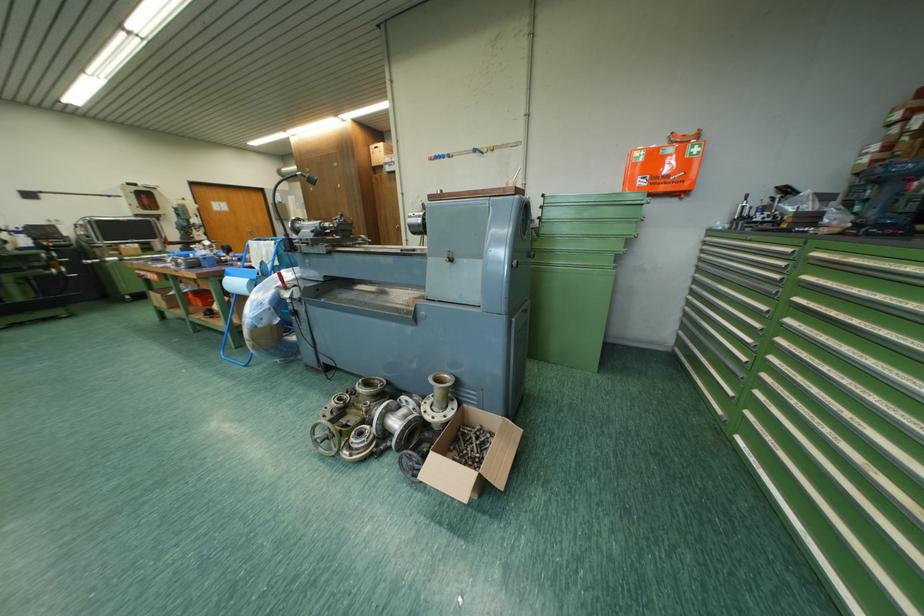
Where would you pull the wooden door handle? Please return your answer as a coordinate pair (x, y).

(249, 233)